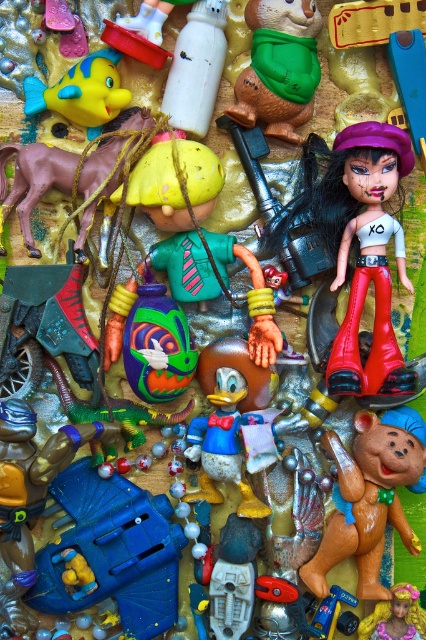
Which is behind, point (336, 154) or point (301, 52)?

Positioned behind is point (336, 154).

Is white glossy doll at center right taller than green rubber bear at center?

Indeed, white glossy doll at center right has a greater height compared to green rubber bear at center.

The width and height of the screenshot is (426, 640). Find the location of `white glossy doll at center right`. white glossy doll at center right is located at coordinates (365, 252).

Between matte plastic horse at left and rubber yellow fish at upper left, which one has less height?

With less height is rubber yellow fish at upper left.

Is matte plastic horse at left above rubber yellow fish at upper left?

Actually, matte plastic horse at left is below rubber yellow fish at upper left.

Is point (60, 164) farther from camera compared to point (92, 76)?

Yes, it is behind point (92, 76).

At what (x,y) coordinates should I click in order to perform the action: click on matte plastic horse at left. Please return your answer as a coordinate pair (x, y). Looking at the image, I should click on (34, 180).

Which of these two, white glossy doll at center right or rubber yellow fish at upper left, stands shorter?

rubber yellow fish at upper left

Looking at this image, between white glossy doll at center right and rubber yellow fish at upper left, which one is positioned lower?

white glossy doll at center right is lower down.

At what (x,y) coordinates should I click in order to perform the action: click on white glossy doll at center right. Please return your answer as a coordinate pair (x, y). Image resolution: width=426 pixels, height=640 pixels. Looking at the image, I should click on (365, 252).